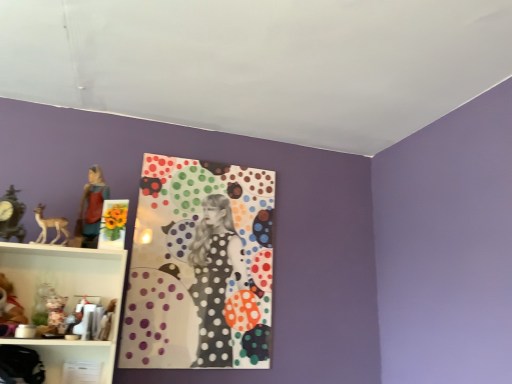
Question: From a real-world perspective, is matte black clock at left positioned above or below plush teddy bear at lower left?

Choices:
 (A) below
 (B) above

Answer: (B)

Question: Is matte black clock at left to the left or to the right of plush teddy bear at lower left in the image?

Choices:
 (A) right
 (B) left

Answer: (B)

Question: Considering the real-world distances, which object is farthest from the matte brown deer at left?

Choices:
 (A) matte black clock at left
 (B) polka dot fabric at center
 (C) matte black bag at lower left
 (D) matte brown statue at left
 (E) plush teddy bear at lower left

Answer: (B)

Question: Estimate the real-world distances between objects in this image. Which object is closer to the matte black bag at lower left?

Choices:
 (A) matte brown deer at left
 (B) plush teddy bear at lower left
 (C) matte black clock at left
 (D) polka dot fabric at center
 (E) matte brown statue at left

Answer: (B)